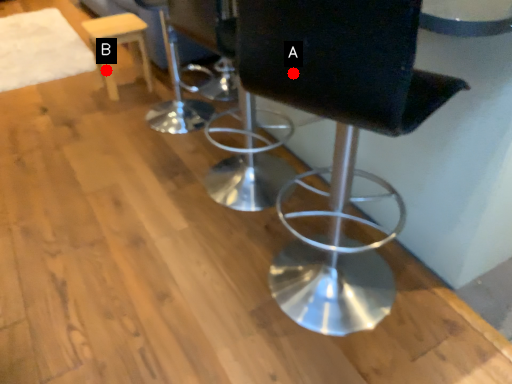
Question: Two points are circled on the image, labeled by A and B beside each circle. Which point appears closest to the camera in this image?

Choices:
 (A) A is closer
 (B) B is closer

Answer: (A)